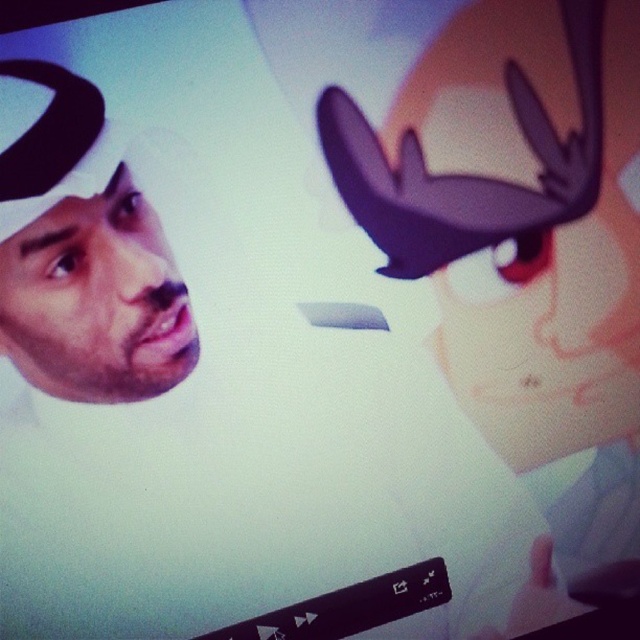
Looking at this image, between matte purple hat at upper right and matte white headscarf at left, which one appears on the right side from the viewer's perspective?

Positioned to the right is matte purple hat at upper right.

Which is in front, point (460, 19) or point (141, 225)?

Point (141, 225) is more forward.

In order to click on matte purple hat at upper right in this screenshot , I will do `click(528, 260)`.